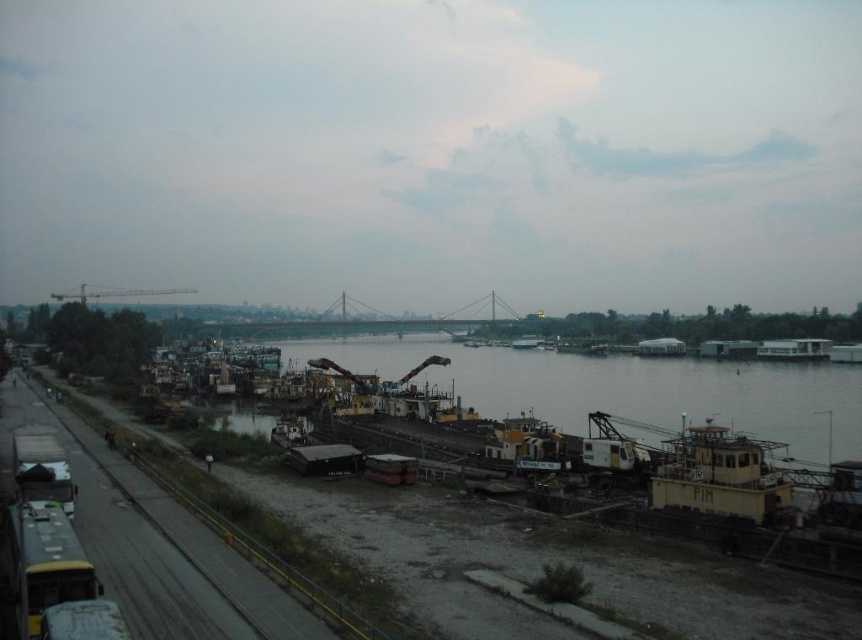
You are a delivery driver who needs to load cargo onto the metallic yellow barge at center. The metallic gray crane at upper center is available for loading. Can you confirm if the crane is positioned in a suitable location to load the barge?

Yes, the metallic yellow barge at center is positioned under the metallic gray crane at upper center, which means the crane is directly above the barge and can lower the cargo down onto it effectively.

You are a delivery truck driver who needs to unload cargo onto both the metallic yellow barge at center and the yellow matte barge at center. The two barges are positioned along the riverbank. Given that your truck can only make one trip to the riverbank, which barge should you prioritize unloading first to ensure you can reach both within the limited time before the river current changes direction?

You should prioritize unloading the metallic yellow barge at center first because it is closer to the yellow matte barge at center by 50.55 meters. By starting with the closer barge, you can efficiently manage your time to reach both before the river current changes direction.